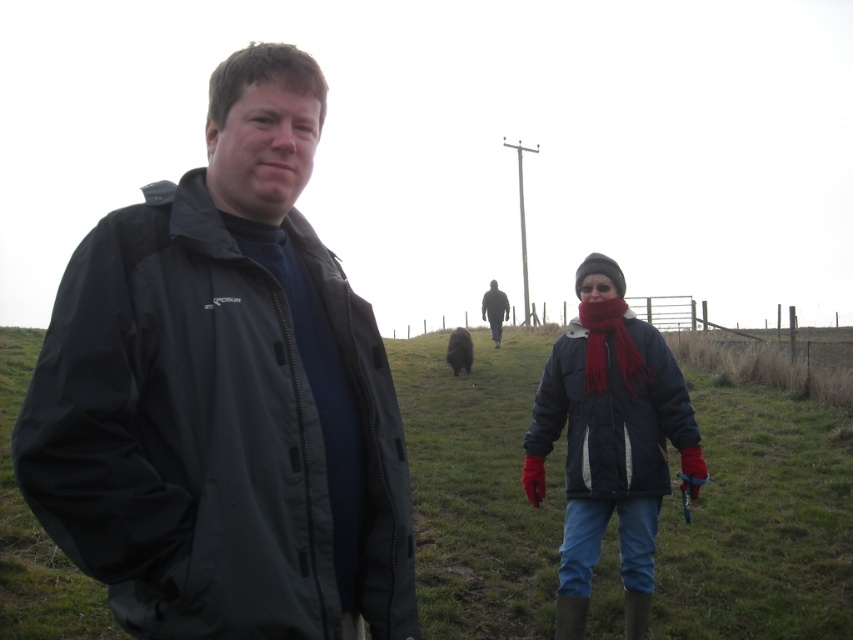
Question: Does matte blue jacket at center appear over maroon knitted scarf at center?

Choices:
 (A) yes
 (B) no

Answer: (B)

Question: Is maroon knitted scarf at center above black fluffy dog at center?

Choices:
 (A) yes
 (B) no

Answer: (A)

Question: Among these objects, which one is nearest to the camera?

Choices:
 (A) matte blue jacket at center
 (B) black fluffy dog at center
 (C) matte black jacket at center

Answer: (C)

Question: Which is nearer to the black fluffy dog at center?

Choices:
 (A) green grassy at center
 (B) matte black jacket at center
 (C) dark blue quilted jacket at center

Answer: (A)

Question: Where is matte black jacket at center located in relation to black fluffy dog at center in the image?

Choices:
 (A) left
 (B) right

Answer: (A)

Question: Among these points, which one is farthest from the camera?

Choices:
 (A) (450, 340)
 (B) (141, 284)

Answer: (A)